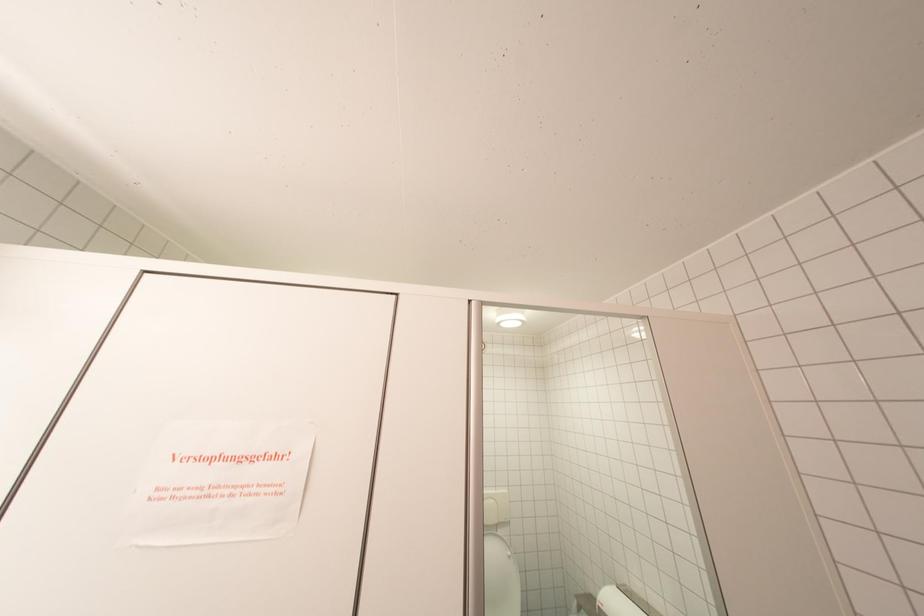
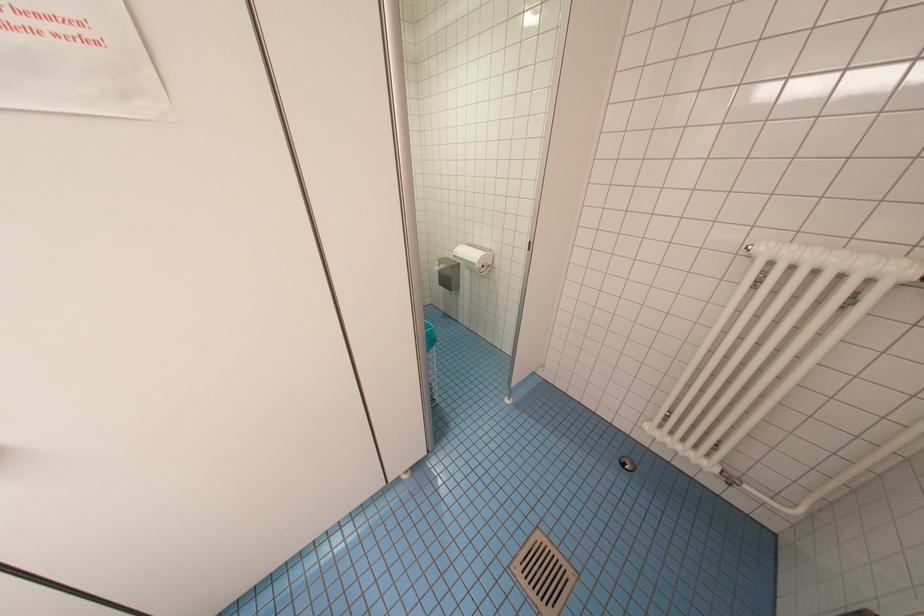
First-person continuous shooting, in which direction is the camera rotating?

The rotation direction of the camera is right-down.